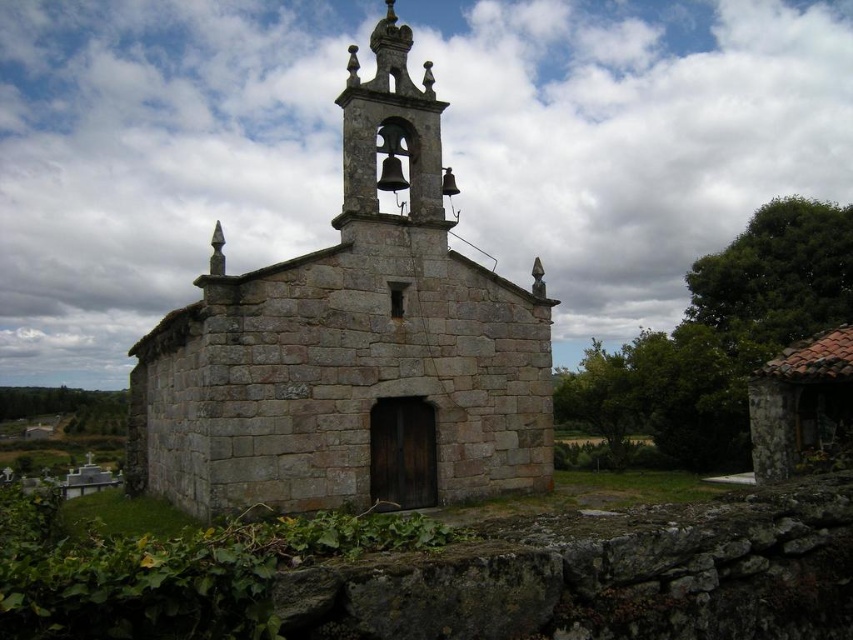
How much distance is there between gray stone church at center and polished bronze bell tower at upper center?

A distance of 27.55 feet exists between gray stone church at center and polished bronze bell tower at upper center.

Who is more forward, (416, 468) or (401, 56)?

Point (416, 468) is in front.

This screenshot has height=640, width=853. I want to click on gray stone church at center, so click(x=352, y=348).